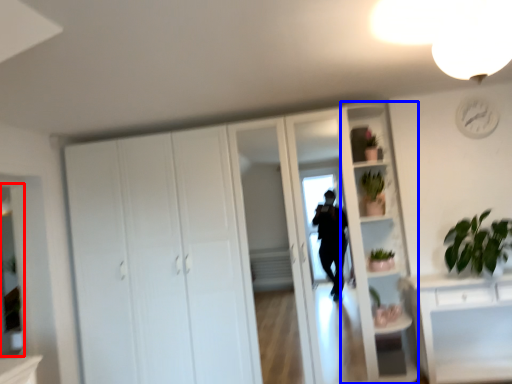
Question: Among these objects, which one is nearest to the camera, mirror (highlighted by a red box) or bookshelf (highlighted by a blue box)?

Choices:
 (A) mirror
 (B) bookshelf

Answer: (A)